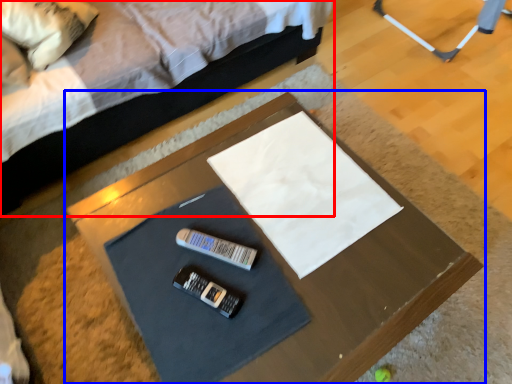
Question: Which point is closer to the camera, bed (highlighted by a red box) or table (highlighted by a blue box)?

Choices:
 (A) bed
 (B) table

Answer: (B)